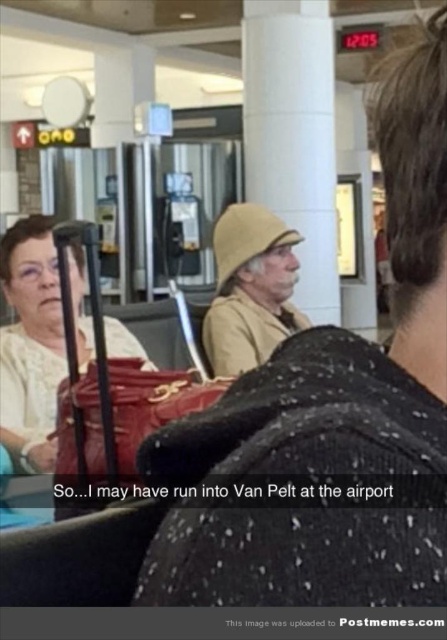
Does beige fabric hat at upper center appear under matte black suitcase at left?

No.

Looking at this image, does beige fabric hat at upper center have a greater height compared to matte black suitcase at left?

Incorrect, beige fabric hat at upper center's height is not larger of matte black suitcase at left's.

Who is more forward, (321, 595) or (29, 352)?

Point (321, 595)

Find the location of a particular element. beige fabric hat at upper center is located at coordinates (329, 419).

Who is more distant from viewer, (26, 436) or (235, 211)?

The point (235, 211) is more distant.

Can you confirm if matte black suitcase at left is positioned to the left of beige fabric hat at center?

Yes, matte black suitcase at left is to the left of beige fabric hat at center.

Does point (50, 272) come closer to viewer compared to point (265, 218)?

Yes, it is in front of point (265, 218).

Find the location of `matte black suitcase at left`. matte black suitcase at left is located at coordinates (30, 342).

Is beige fabric hat at upper center above beige fabric hat at center?

No.

Is beige fabric hat at upper center wider than beige fabric hat at center?

Incorrect, beige fabric hat at upper center's width does not surpass beige fabric hat at center's.

Who is more forward, (202, 472) or (233, 241)?

Point (202, 472) is more forward.

Identify the location of beige fabric hat at upper center. The image size is (447, 640). (329, 419).